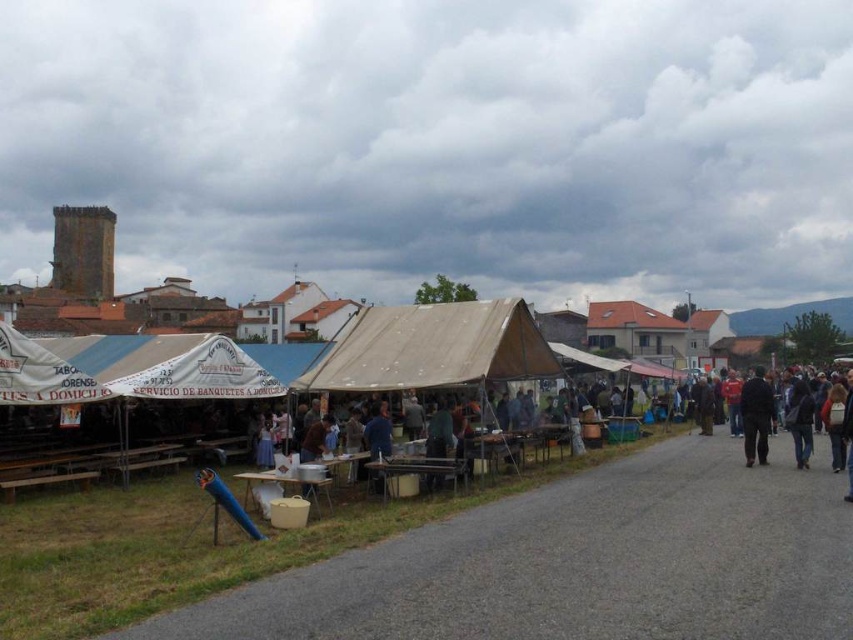
You are standing at the center of the paved road in the outdoor market scene. You want to locate the white fabric canopy at left. In which direction should you look to see it?

The white fabric canopy at left is located at the left side of the scene, so you should look to your left to see it.

You are a customer at the outdoor market and see two items for sale. One is the dark blue fabric at right and the other is the dark blue fabric jacket at lower right. Which item is located to the left of the other?

The dark blue fabric at right is positioned on the left side of dark blue fabric jacket at lower right.

You are a customer at the outdoor market and notice two items made of dark blue fabric. One is the dark blue fabric at right and the other is the dark blue fabric jacket at lower right. Which item is taller?

The dark blue fabric at right is taller than the dark blue fabric jacket at lower right.